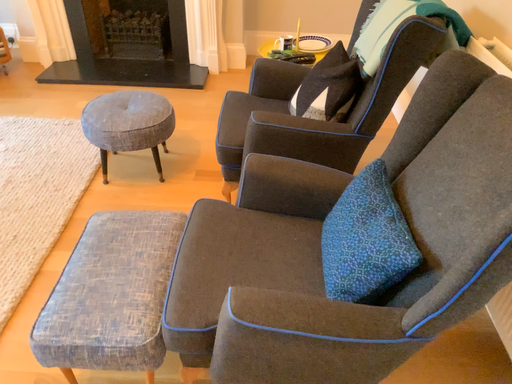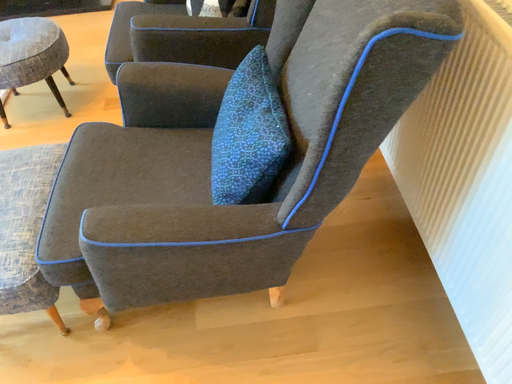
Question: How did the camera likely rotate when shooting the video?

Choices:
 (A) rotated downward
 (B) rotated upward

Answer: (A)